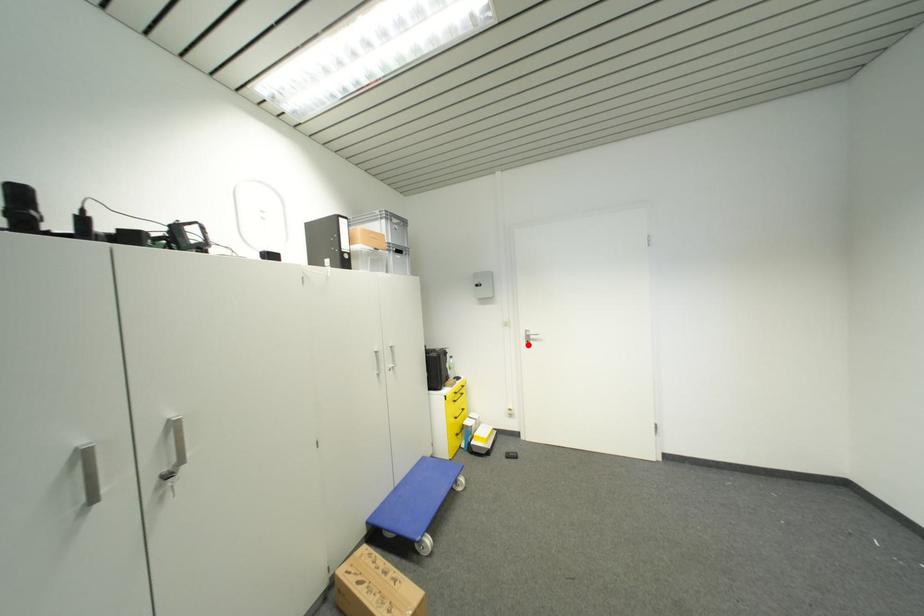
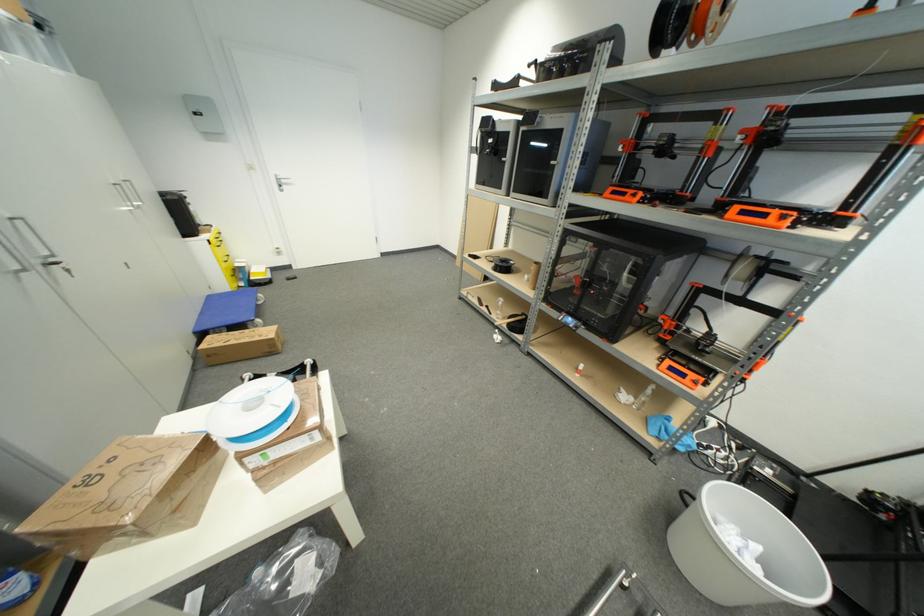
Locate, in the second image, the point that corresponds to the highlighted location in the first image.

(281, 188)